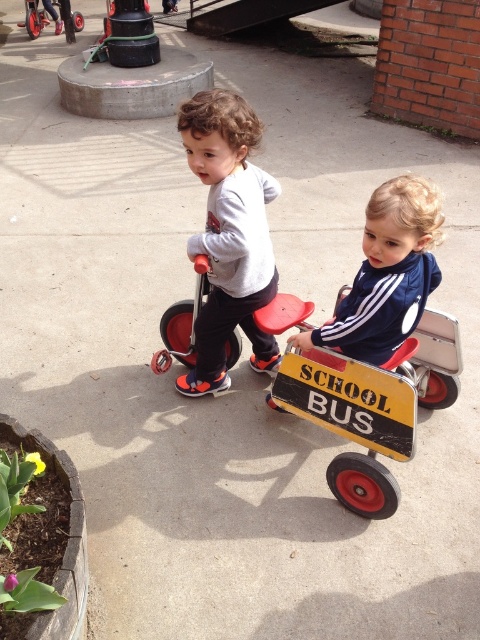
Question: Which object is farther from the camera taking this photo?

Choices:
 (A) blue smooth jacket at center
 (B) gray matte shirt at center

Answer: (B)

Question: Does gray matte shirt at center have a larger size compared to blue smooth jacket at center?

Choices:
 (A) yes
 (B) no

Answer: (A)

Question: Is gray matte shirt at center in front of blue smooth jacket at center?

Choices:
 (A) no
 (B) yes

Answer: (A)

Question: Which point is farther from the camera taking this photo?

Choices:
 (A) pos(255,339)
 (B) pos(370,342)

Answer: (A)

Question: Where is gray matte shirt at center located in relation to blue smooth jacket at center in the image?

Choices:
 (A) left
 (B) right

Answer: (A)